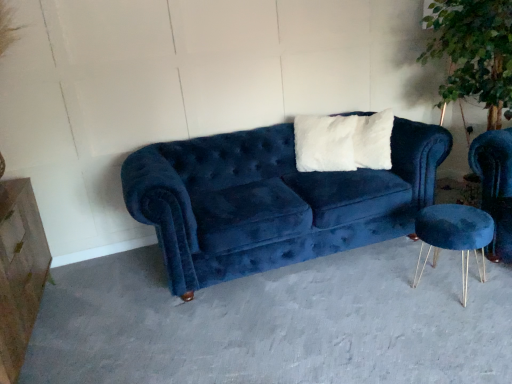
Question: Considering the relative positions of marble/stone dresser at left and green leafy plant at upper right in the image provided, is marble/stone dresser at left in front of green leafy plant at upper right?

Choices:
 (A) no
 (B) yes

Answer: (B)

Question: Would you say marble/stone dresser at left is outside green leafy plant at upper right?

Choices:
 (A) yes
 (B) no

Answer: (A)

Question: From a real-world perspective, is marble/stone dresser at left located beneath green leafy plant at upper right?

Choices:
 (A) no
 (B) yes

Answer: (B)

Question: Does marble/stone dresser at left appear on the right side of green leafy plant at upper right?

Choices:
 (A) no
 (B) yes

Answer: (A)

Question: Would you say marble/stone dresser at left is a long distance from green leafy plant at upper right?

Choices:
 (A) no
 (B) yes

Answer: (B)

Question: Choose the correct answer: Is green leafy plant at upper right inside velvet blue couch at center or outside it?

Choices:
 (A) outside
 (B) inside

Answer: (A)

Question: In terms of height, does green leafy plant at upper right look taller or shorter compared to velvet blue couch at center?

Choices:
 (A) tall
 (B) short

Answer: (A)

Question: From the image's perspective, is green leafy plant at upper right positioned above or below velvet blue couch at center?

Choices:
 (A) above
 (B) below

Answer: (A)

Question: Is green leafy plant at upper right to the left or to the right of velvet blue couch at center in the image?

Choices:
 (A) left
 (B) right

Answer: (B)

Question: Relative to marble/stone dresser at left, is velvet blue couch at center in front or behind?

Choices:
 (A) behind
 (B) front

Answer: (A)

Question: Based on their positions, is velvet blue couch at center located to the left or right of marble/stone dresser at left?

Choices:
 (A) right
 (B) left

Answer: (A)

Question: Looking at their shapes, would you say velvet blue couch at center is wider or thinner than marble/stone dresser at left?

Choices:
 (A) wide
 (B) thin

Answer: (A)

Question: Is velvet blue couch at center taller or shorter than marble/stone dresser at left?

Choices:
 (A) tall
 (B) short

Answer: (A)

Question: From a real-world perspective, relative to white fluffy pillow at center, is velvet blue couch at center vertically above or below?

Choices:
 (A) below
 (B) above

Answer: (A)

Question: Choose the correct answer: Is velvet blue couch at center inside white fluffy pillow at center or outside it?

Choices:
 (A) outside
 (B) inside

Answer: (A)